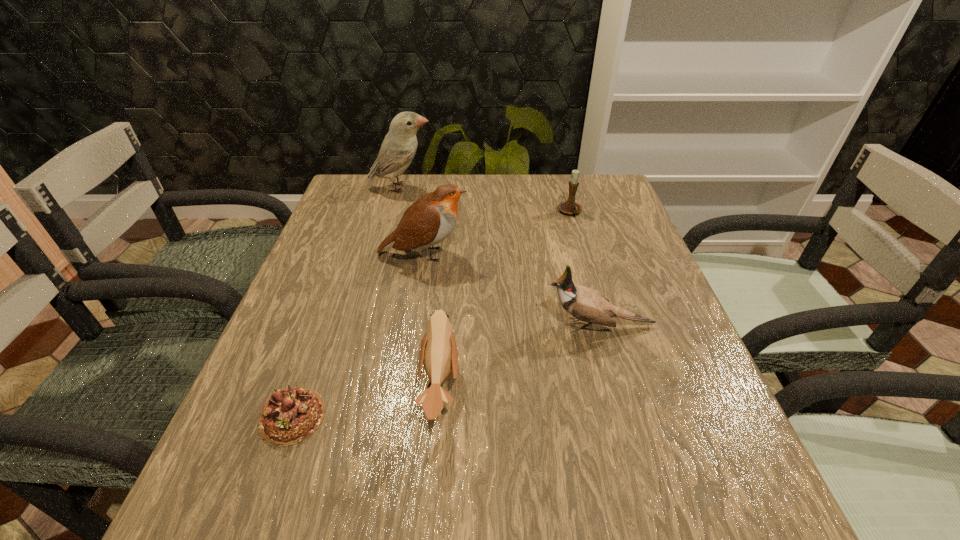
Select which bird is the closest to the second shortest bird. Please provide its 2D coordinates. Your answer should be formatted as a tuple, i.e. [(x, y)], where the tuple contains the x and y coordinates of a point satisfying the conditions above.

[(438, 352)]

Image resolution: width=960 pixels, height=540 pixels. In order to click on vacant space that satisfies the following two spatial constraints: 1. at the face of the second shortest bird; 2. on the front side of the shortest object in this screenshot , I will do `click(623, 416)`.

I want to click on vacant space that satisfies the following two spatial constraints: 1. on the side of the second farthest object with the handle; 2. at the beak of the shortest bird, so click(620, 388).

Locate an element on the screen. The image size is (960, 540). free space that satisfies the following two spatial constraints: 1. on the side of the second farthest object with the handle; 2. at the face of the third tallest bird is located at coordinates (603, 326).